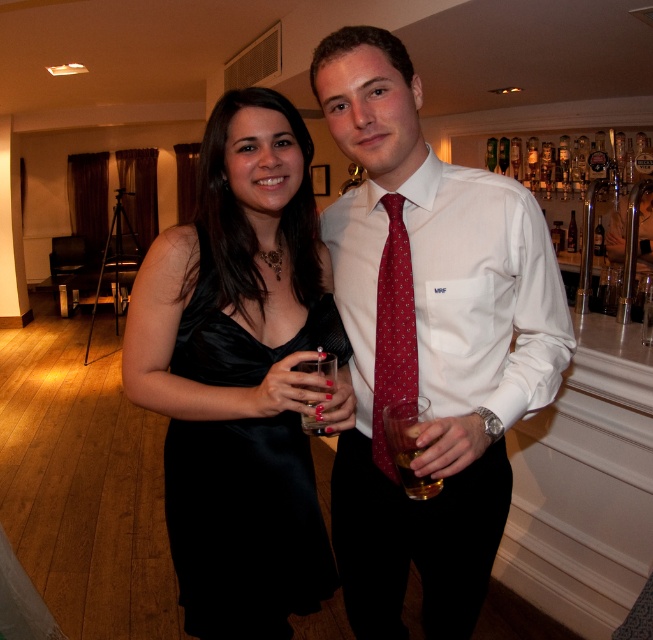
You are a photographer at this event and need to capture a clear photo of the white silk shirt at center and the translucent glass at lower center. The camera has a minimum focus distance of 12 inches. Will you be able to focus on both objects without moving the camera?

The white silk shirt at center is 12.65 inches away from the translucent glass at lower center. Since the minimum focus distance is 12 inches, the camera can focus on both objects as the distance between them is greater than the required minimum.

You are a photographer at the event and want to ensure both the white silk shirt at center and the translucent glass at lower center are in focus. Given that your camera can only focus on objects taller than 15 cm, can both be captured clearly?

The white silk shirt at center is taller than the translucent glass at lower center. Since the camera requires objects taller than 15 cm to be in focus, and the white silk shirt is taller than the glass, it is possible that both could be in focus if the glass meets the minimum height requirement. However, without knowing the exact height of the glass, we cannot confirm definitively.

You are at a formal event and need to adjust your attire. You see the white silk shirt at center and the red dotted tie at center. Which item should you adjust first if you want to ensure the taller item is properly aligned?

You should adjust the white silk shirt at center first because it has a greater height compared to the red dotted tie at center, so aligning it properly ensures the taller item is correctly positioned.